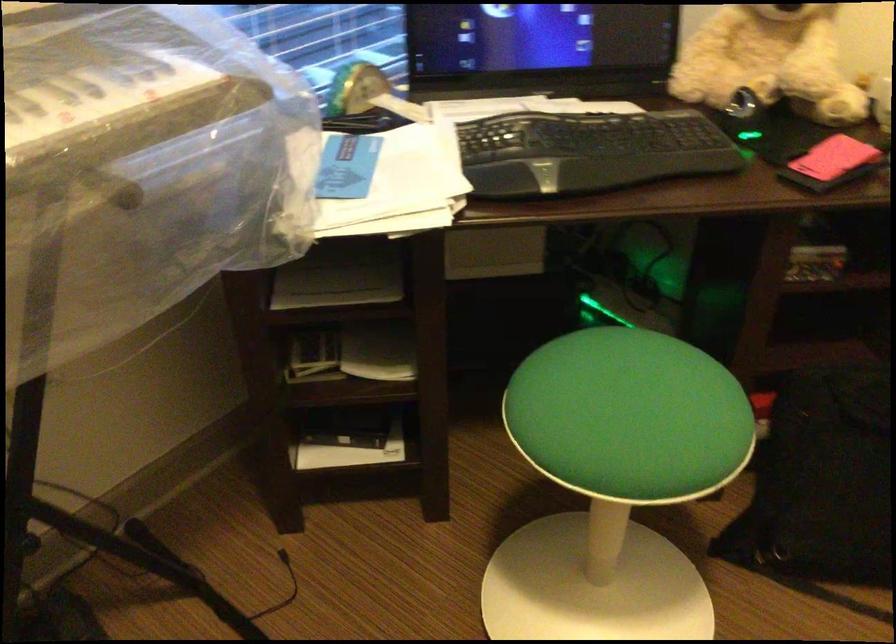
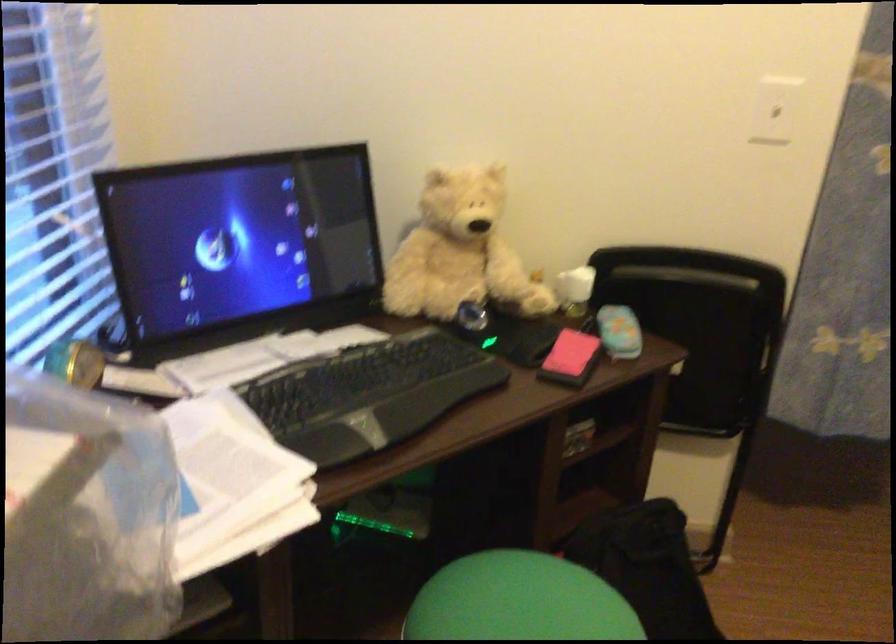
Question: The first image is from the beginning of the video and the second image is from the end. How did the camera likely rotate when shooting the video?

Choices:
 (A) Left
 (B) Right
 (C) Up
 (D) Down

Answer: (B)